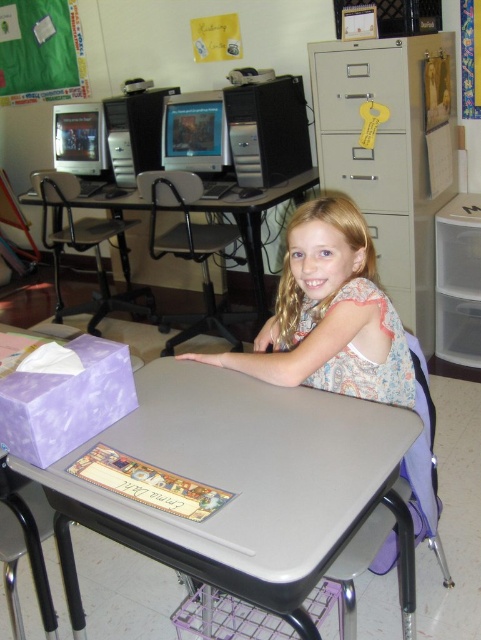
Question: Considering the relative positions of matte gray table at center and beige/file cabinet at upper center in the image provided, where is matte gray table at center located with respect to beige/file cabinet at upper center?

Choices:
 (A) below
 (B) above

Answer: (A)

Question: Can you confirm if matte gray table at center is thinner than gray plastic table at center?

Choices:
 (A) yes
 (B) no

Answer: (B)

Question: Which object is positioned farthest from the matte gray table at center?

Choices:
 (A) beige/file cabinet at upper center
 (B) gray plastic table at center
 (C) floral dress at center

Answer: (B)

Question: Can you confirm if matte gray table at center is positioned to the left of gray plastic table at center?

Choices:
 (A) no
 (B) yes

Answer: (B)

Question: Among these objects, which one is farthest from the camera?

Choices:
 (A) floral dress at center
 (B) beige/file cabinet at upper center
 (C) gray plastic table at center

Answer: (C)

Question: Among these points, which one is farthest from the camera?

Choices:
 (A) (261, 285)
 (B) (418, 156)
 (C) (216, 534)

Answer: (A)